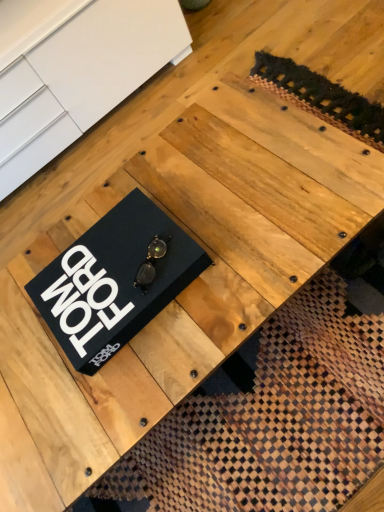
Question: In terms of width, does black matte box at center look wider or thinner when compared to black matte book at center?

Choices:
 (A) wide
 (B) thin

Answer: (B)

Question: From the image's perspective, is black matte box at center located above or below black matte book at center?

Choices:
 (A) above
 (B) below

Answer: (B)

Question: Considering their positions, is black matte box at center located in front of or behind black matte book at center?

Choices:
 (A) front
 (B) behind

Answer: (A)

Question: Would you say black matte book at center is inside or outside black matte box at center?

Choices:
 (A) outside
 (B) inside

Answer: (A)

Question: From a real-world perspective, is black matte book at center physically located above or below black matte box at center?

Choices:
 (A) above
 (B) below

Answer: (B)

Question: From the image's perspective, is black matte book at center above or below black matte box at center?

Choices:
 (A) above
 (B) below

Answer: (A)

Question: Is point (13, 9) closer or farther from the camera than point (114, 245)?

Choices:
 (A) farther
 (B) closer

Answer: (A)